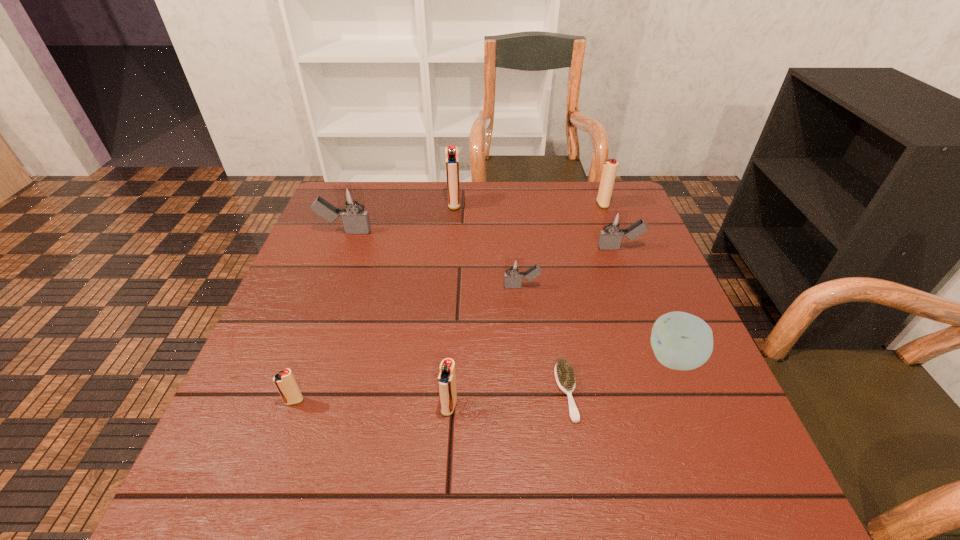
The width and height of the screenshot is (960, 540). Identify the location of object that ranks as the sixth closest to the rightmost red igniter. (355, 220).

Point out which object is positioned as the sixth nearest to the third farthest object. Please provide its 2D coordinates. Your answer should be formatted as a tuple, i.e. [(x, y)], where the tuple contains the x and y coordinates of a point satisfying the conditions above.

[(614, 223)]

Where is `igniter that is the closest one to the smallest red igniter`? igniter that is the closest one to the smallest red igniter is located at coordinates (447, 379).

Locate which igniter ranks sixth in proximity to the rightmost red igniter. Please provide its 2D coordinates. Your answer should be formatted as a tuple, i.e. [(x, y)], where the tuple contains the x and y coordinates of a point satisfying the conditions above.

[(285, 382)]

The height and width of the screenshot is (540, 960). Find the location of `red igniter that stands as the third closest to the white apple`. red igniter that stands as the third closest to the white apple is located at coordinates (x=451, y=152).

Choose which red igniter is the fourth nearest neighbor to the fifth nearest object. Please provide its 2D coordinates. Your answer should be formatted as a tuple, i.e. [(x, y)], where the tuple contains the x and y coordinates of a point satisfying the conditions above.

[(285, 382)]

Identify which gray igniter is located as the third nearest to the sixth object from left to right. Please provide its 2D coordinates. Your answer should be formatted as a tuple, i.e. [(x, y)], where the tuple contains the x and y coordinates of a point satisfying the conditions above.

[(355, 220)]

Point out which gray igniter is positioned as the second nearest to the rightmost red igniter. Please provide its 2D coordinates. Your answer should be formatted as a tuple, i.e. [(x, y)], where the tuple contains the x and y coordinates of a point satisfying the conditions above.

[(514, 267)]

Identify the location of free spot that satisfies the following two spatial constraints: 1. on the front side of the apple; 2. on the right side of the third farthest igniter. The width and height of the screenshot is (960, 540). (297, 359).

This screenshot has width=960, height=540. I want to click on free spot that satisfies the following two spatial constraints: 1. on the back side of the smallest red igniter; 2. on the left side of the biggest red igniter, so point(364,204).